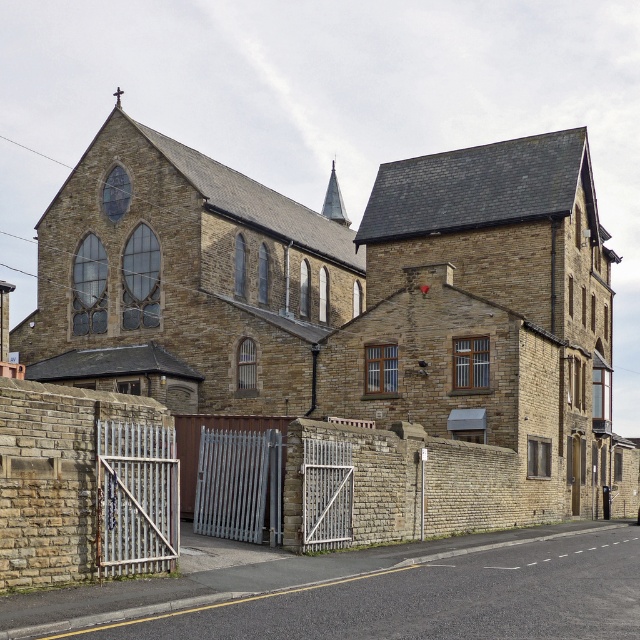
Identify the location of brown stone church at center. The image size is (640, 640). (346, 298).